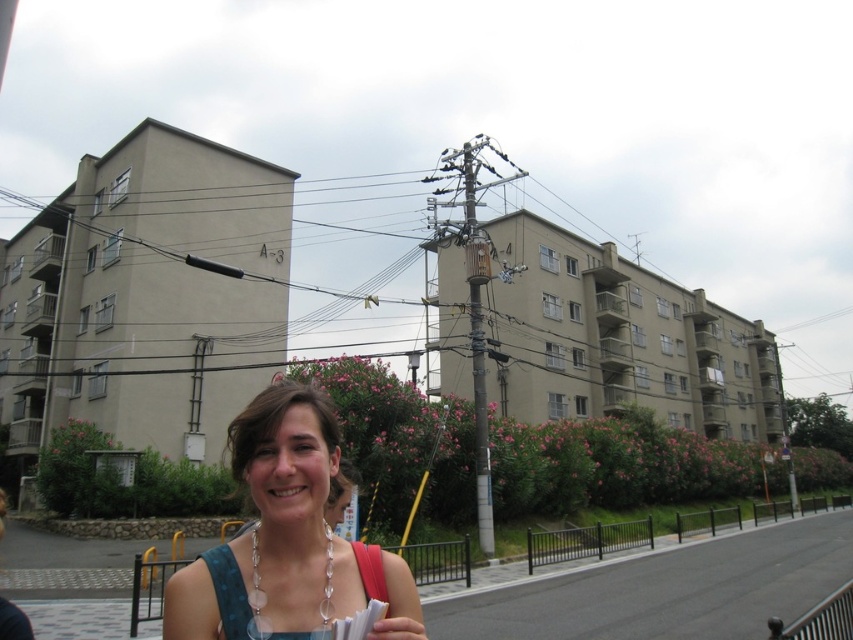
Based on the photo, is matte blue dress at center behind smooth skin hand at lower center?

Yes, it is behind smooth skin hand at lower center.

Who is taller, matte blue dress at center or smooth skin hand at lower center?

matte blue dress at center

Is point (381, 564) positioned before point (422, 637)?

No, it is not.

The image size is (853, 640). In order to click on matte blue dress at center in this screenshot , I will do `click(274, 532)`.